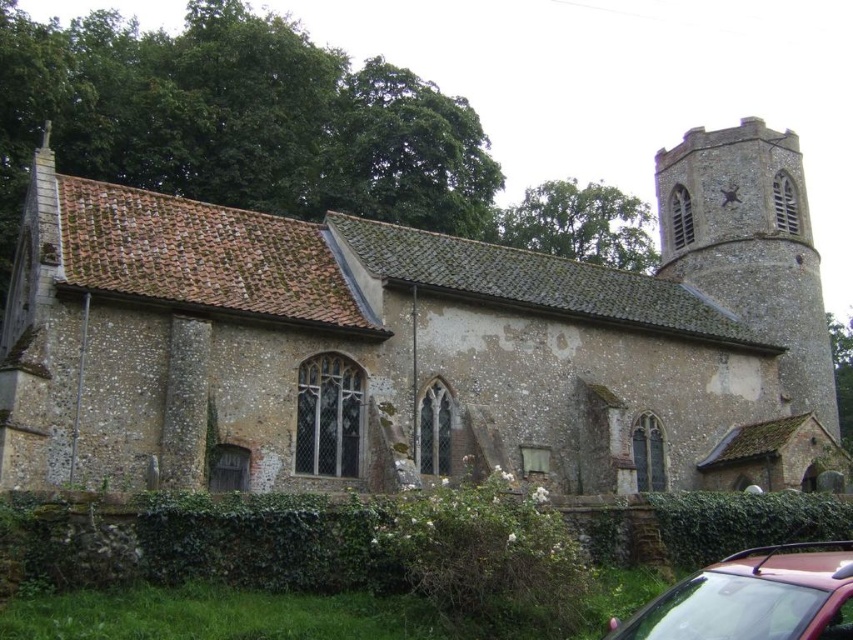
Can you confirm if stone church at center is positioned below shiny red car at lower right?

No, stone church at center is not below shiny red car at lower right.

Which is below, stone church at center or shiny red car at lower right?

shiny red car at lower right is below.

Which is in front, point (709, 467) or point (740, 570)?

Positioned in front is point (740, 570).

Find the location of a particular element. This screenshot has height=640, width=853. stone church at center is located at coordinates (418, 342).

This screenshot has width=853, height=640. What do you see at coordinates (750, 246) in the screenshot?
I see `stone steeple at upper right` at bounding box center [750, 246].

Which is behind, point (808, 401) or point (798, 628)?

Point (808, 401)

Locate an element on the screen. This screenshot has width=853, height=640. stone steeple at upper right is located at coordinates (750, 246).

Who is lower down, stone church at center or stone steeple at upper right?

Positioned lower is stone church at center.

Does stone church at center have a smaller size compared to stone steeple at upper right?

Incorrect, stone church at center is not smaller in size than stone steeple at upper right.

Is point (698, 237) closer to camera compared to point (659, 150)?

That is True.

Where is `stone church at center`? The width and height of the screenshot is (853, 640). stone church at center is located at coordinates (418, 342).